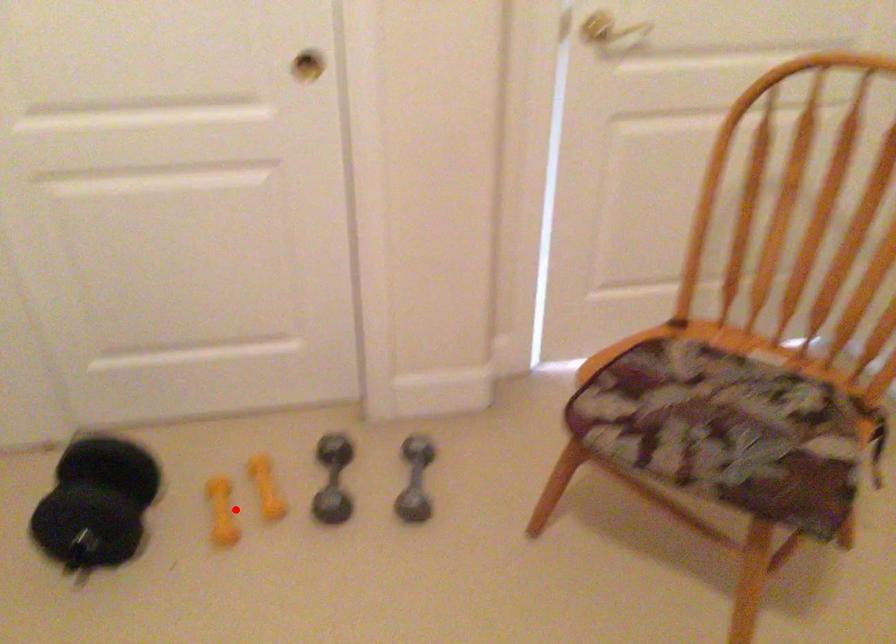
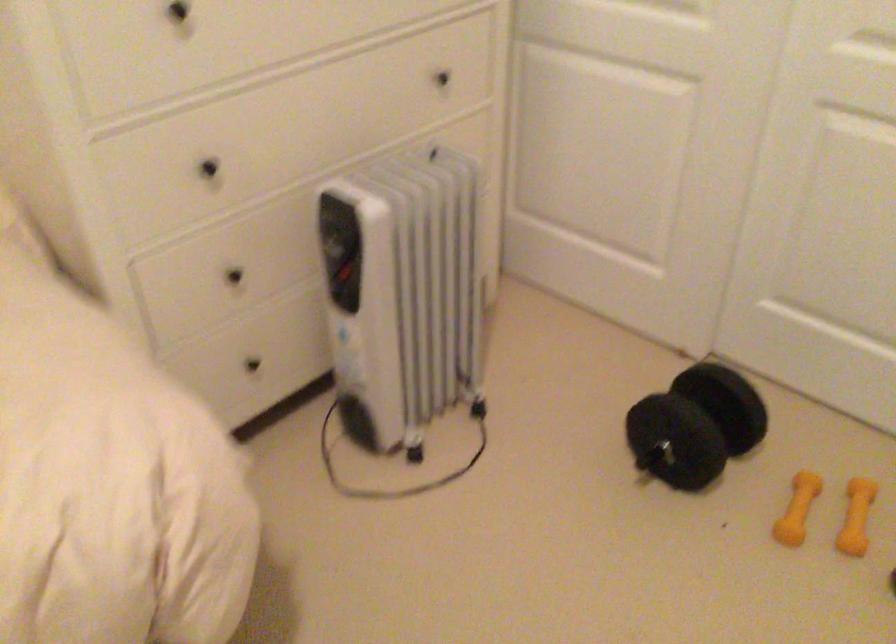
In the second image, find the point that corresponds to the highlighted location in the first image.

(797, 509)